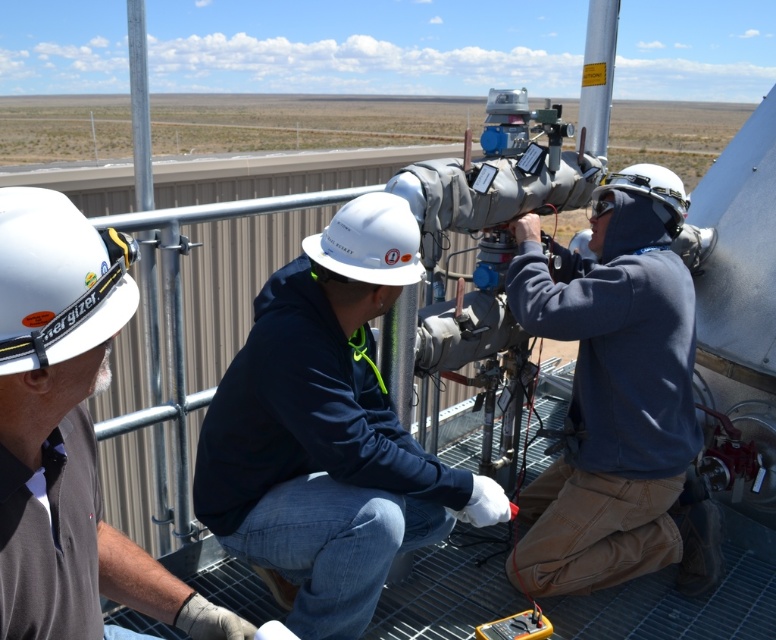
Question: Which point is closer to the camera?

Choices:
 (A) (279, 336)
 (B) (399, 218)

Answer: (A)

Question: Among these objects, which one is farthest from the camera?

Choices:
 (A) white hard hat at left
 (B) white hard hat at center
 (C) gray metallic telescope at center

Answer: (C)

Question: Is dark blue hoodie at center thinner than white hard hat at upper left?

Choices:
 (A) no
 (B) yes

Answer: (A)

Question: Considering the real-world distances, which object is closest to the gray metallic telescope at center?

Choices:
 (A) blue fleece jacket at center
 (B) white hard hat at upper left
 (C) dark blue hoodie at center
 (D) white hard hat at left

Answer: (A)

Question: Does blue fleece jacket at center appear on the left side of white hard hat at upper left?

Choices:
 (A) no
 (B) yes

Answer: (A)

Question: Observing the image, what is the correct spatial positioning of dark blue hoodie at center in reference to blue fleece jacket at center?

Choices:
 (A) right
 (B) left

Answer: (B)